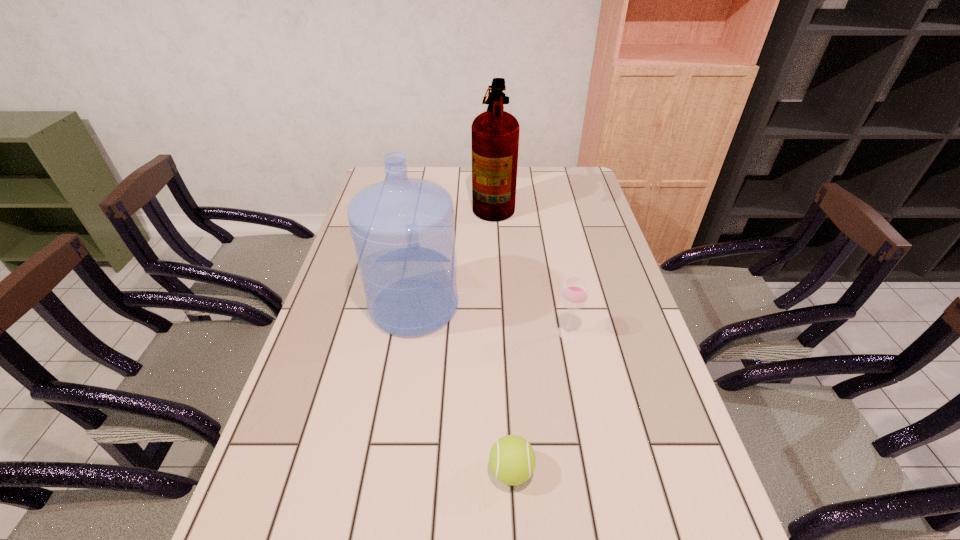
In order to click on free space located on the side of the leftmost object with the handle in this screenshot , I will do `click(427, 222)`.

Identify the location of free location located on the side of the leftmost object with the handle. This screenshot has width=960, height=540. (425, 234).

Locate an element on the screen. free space located on the back of the wineglass is located at coordinates (551, 248).

Locate an element on the screen. Image resolution: width=960 pixels, height=540 pixels. free space located 0.300m on the right of the nearest object is located at coordinates (684, 471).

Identify the location of object situated at the far edge. (495, 133).

Where is `object that is at the left edge`? Image resolution: width=960 pixels, height=540 pixels. object that is at the left edge is located at coordinates (403, 229).

I want to click on free space at the left edge of the desktop, so click(305, 418).

Find the location of `vacant space at the right edge`. vacant space at the right edge is located at coordinates (617, 374).

In the image, there is a desktop. Where is `blank space at the far right corner`? The image size is (960, 540). blank space at the far right corner is located at coordinates (584, 168).

Identify the location of free space that is in between the water jug and the shortest object. (463, 388).